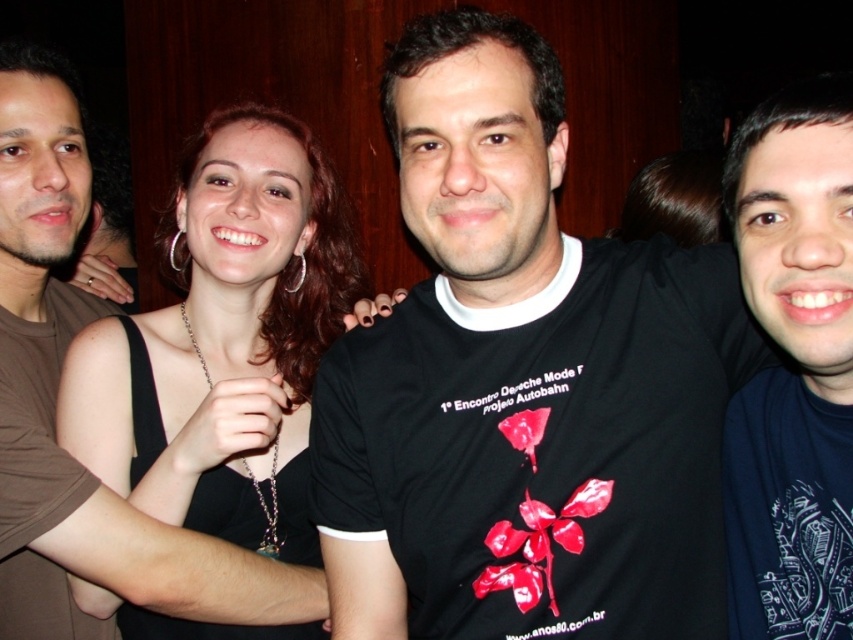
Between point (593, 480) and point (776, 602), which one is positioned behind?

Point (776, 602)

Between black t-shirt at center and dark blue t-shirt at center, which one appears on the right side from the viewer's perspective?

dark blue t-shirt at center is more to the right.

Is point (456, 35) farther from camera compared to point (744, 502)?

No, it is not.

Identify the location of black t-shirt at center. (523, 384).

Does black t-shirt at center appear on the left side of black fabric dress at center?

In fact, black t-shirt at center is to the right of black fabric dress at center.

Who is positioned more to the left, black t-shirt at center or black fabric dress at center?

From the viewer's perspective, black fabric dress at center appears more on the left side.

What do you see at coordinates (523, 384) in the screenshot? Image resolution: width=853 pixels, height=640 pixels. I see `black t-shirt at center` at bounding box center [523, 384].

I want to click on black t-shirt at center, so click(x=523, y=384).

Can you confirm if black fabric dress at center is positioned above dark blue t-shirt at center?

Yes, black fabric dress at center is above dark blue t-shirt at center.

Where is `black fabric dress at center`? black fabric dress at center is located at coordinates (224, 340).